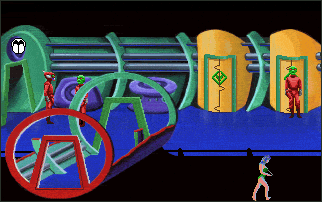
Where is `black floor`? The image size is (322, 202). black floor is located at coordinates (211, 190).